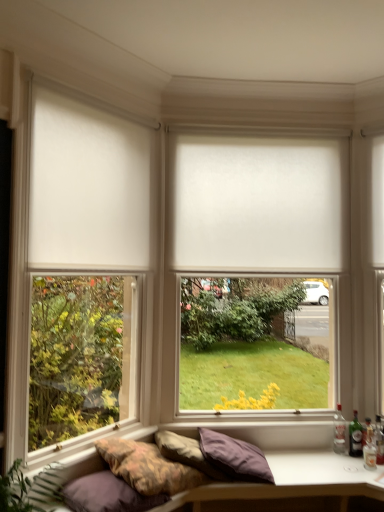
Question: Considering the positions of clear glass bottle at lower right, which is counted as the fourth bottle, starting from the right, and white matte curtain at left in the image, is clear glass bottle at lower right, which is counted as the fourth bottle, starting from the right, bigger or smaller than white matte curtain at left?

Choices:
 (A) big
 (B) small

Answer: (B)

Question: From a real-world perspective, relative to white matte curtain at left, is clear glass bottle at lower right, which is counted as the fourth bottle, starting from the right, vertically above or below?

Choices:
 (A) below
 (B) above

Answer: (A)

Question: Which is nearer to the textured fabric studio couch at lower center?

Choices:
 (A) purple cotton pillow at lower left, which is the 3th pillow from right to left
 (B) white matte curtain at left
 (C) purple fabric pillow at lower center, the second pillow in the right-to-left sequence
 (D) green glass bottle at lower right, which appears as the 2th bottle when viewed from the left
 (E) white matte window blind at center

Answer: (C)

Question: Estimate the real-world distances between objects in this image. Which object is farther from the white matte curtain at left?

Choices:
 (A) translucent glass bottle at right, the first bottle viewed from the right
 (B) green glass bottle at lower right, which appears as the 3th bottle when viewed from the right
 (C) white matte window at center
 (D) translucent glass bottle at right, which appears as the second bottle when viewed from the right
 (E) textured fabric studio couch at lower center

Answer: (A)